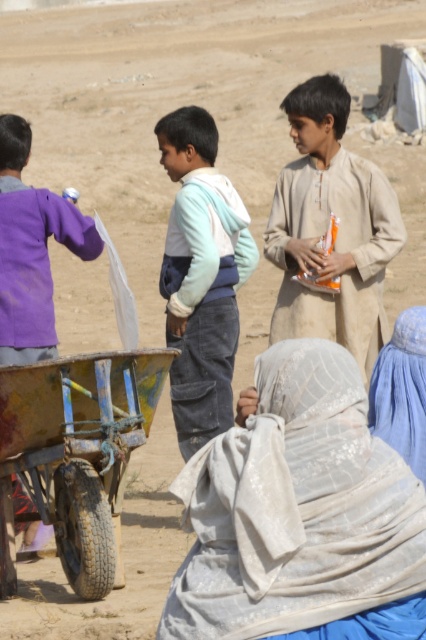
Question: Considering the real-world distances, which object is closest to the purple cotton shirt at left?

Choices:
 (A) light beige lace headscarf at center
 (B) rusty metal wagon at lower left
 (C) beige cotton shirt at center

Answer: (B)

Question: Among these objects, which one is nearest to the camera?

Choices:
 (A) light blue denim pants at center
 (B) beige cotton shirt at center
 (C) rusty metal wagon at lower left
 (D) light beige lace headscarf at center

Answer: (D)

Question: Observing the image, what is the correct spatial positioning of rusty metal wagon at lower left in reference to purple cotton shirt at left?

Choices:
 (A) below
 (B) above

Answer: (A)

Question: Is light beige lace headscarf at center below light blue denim pants at center?

Choices:
 (A) no
 (B) yes

Answer: (B)

Question: Is purple cotton shirt at left below blue fabric headscarf at lower right?

Choices:
 (A) yes
 (B) no

Answer: (B)

Question: Which point is farther to the camera?

Choices:
 (A) (203, 257)
 (B) (377, 428)
 (C) (66, 572)

Answer: (A)